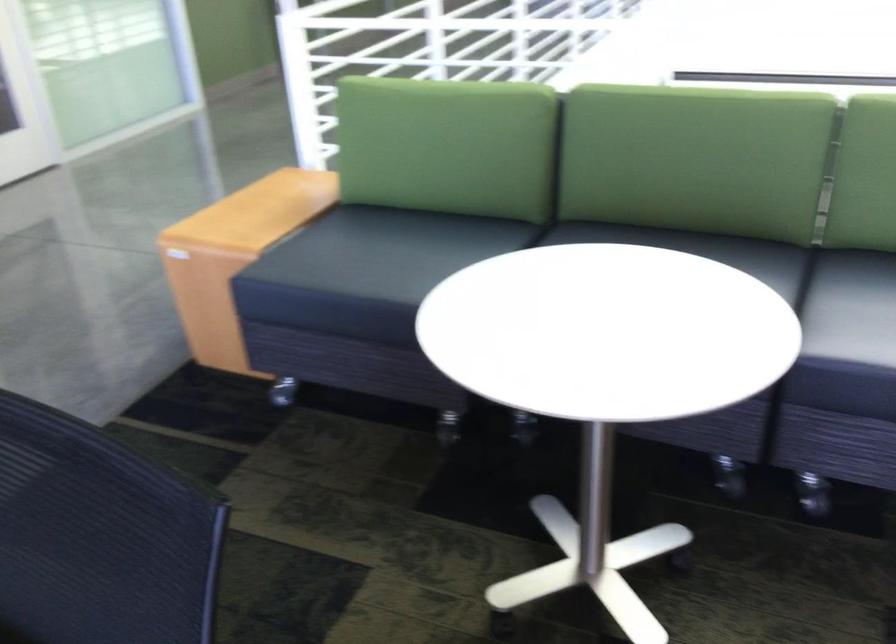
Locate an element on the screen. wooden sofa armrest is located at coordinates (254, 214).